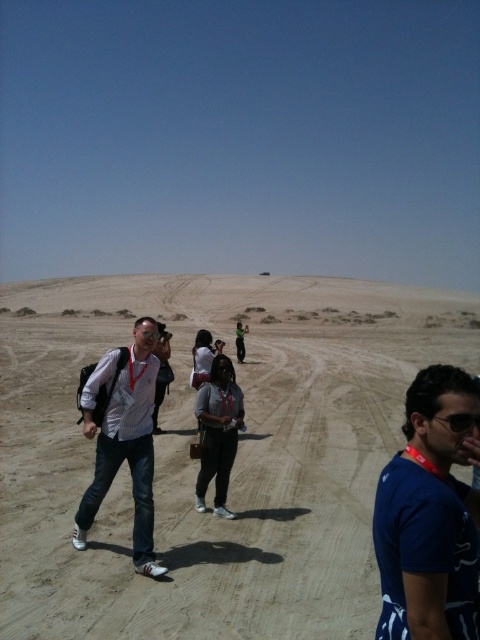
You are a photographer trying to capture a clear shot of both the matte gray shirt at center and the black plastic goggles at center. Since you want to ensure both are in focus, you need to know their positions relative to each other. Which object is positioned to the left?

The matte gray shirt at center is to the left of the black plastic goggles at center.

You are a photographer standing in the desert and see the white shirt at center and the matte gray shirt at center. You want to take a photo that includes both shirts in the frame. Based on their distance, is it possible to capture both in a single shot without moving the subjects?

The white shirt at center and the matte gray shirt at center are 3.94 feet apart, so yes, it is possible to capture both in a single shot without moving the subjects as they are within a reasonable distance for a photograph.